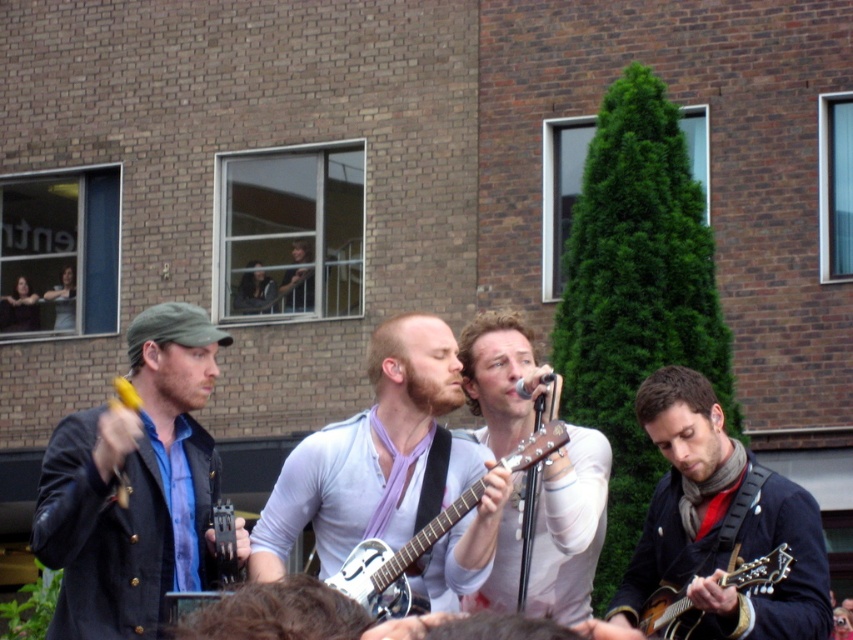
Which is more to the left, matte black jacket at left or dark blue jacket at center?

Positioned to the left is matte black jacket at left.

In the scene shown: Does matte black jacket at left have a greater height compared to dark blue jacket at center?

Yes.

Who is more distant from viewer, (70, 419) or (672, 420)?

Point (672, 420)

At what (x,y) coordinates should I click in order to perform the action: click on matte black jacket at left. Please return your answer as a coordinate pair (x, y). Looking at the image, I should click on (134, 484).

Which is in front, point (111, 477) or point (378, 620)?

Point (111, 477) is in front.

Is matte black guitar at center thinner than metallic silver resonator guitar at center?

No.

Between point (183, 528) and point (407, 557), which one is positioned in front?

Point (407, 557)

What are the coordinates of `matte black guitar at center` in the screenshot? It's located at (134, 484).

This screenshot has height=640, width=853. What do you see at coordinates (396, 561) in the screenshot? I see `metallic silver resonator guitar at center` at bounding box center [396, 561].

Can you confirm if metallic silver resonator guitar at center is taller than wooden acoustic guitar at lower right?

Yes.

Is point (368, 566) more distant than point (746, 584)?

That is True.

Identify the location of metallic silver resonator guitar at center. [x=396, y=561].